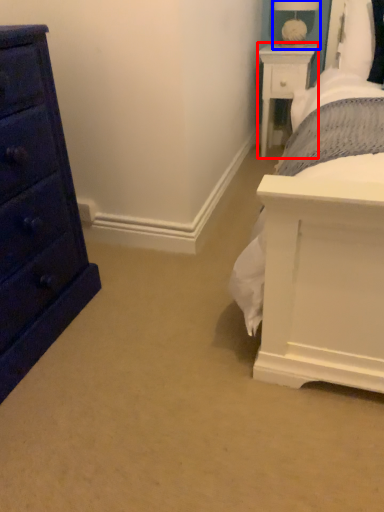
Question: Which object is further to the camera taking this photo, nightstand (highlighted by a red box) or table lamp (highlighted by a blue box)?

Choices:
 (A) nightstand
 (B) table lamp

Answer: (A)